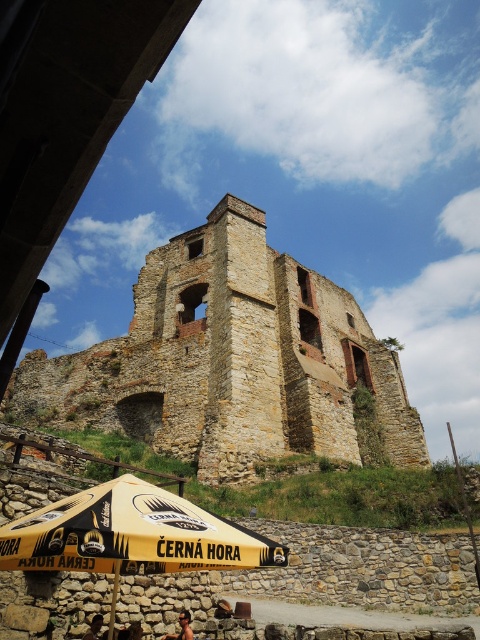
You are standing at the base of the historical stone structure and want to take a photo of the castle. There are two points marked in the image. The first point is at coordinates point (181, 624) and the second point is at coordinates point (92, 634). Which point is closer to you?

Point (92, 634) is closer to you because it is in front of point (181, 624).

You are standing at the base of the historical stone structure and want to take a photo of the castle. The camera you are using has a focal length of 50mm and a sensor size of 24mm x 36mm. The point at coordinate point (186, 612) is part of the castle structure. If you want to ensure the entire castle structure fits in your photo, what is the minimum distance you should be from the castle?

The point at coordinate point (186, 612) is 35.77 meters away from the viewer. To ensure the entire castle structure fits in the photo, you should be at least 35.77 meters away from the castle.

You are standing in front of a historical stone structure and see a point marked at coordinates (181,627). What does this point represent?

The point at coordinates (181,627) represents sun kissed skin at lower center.